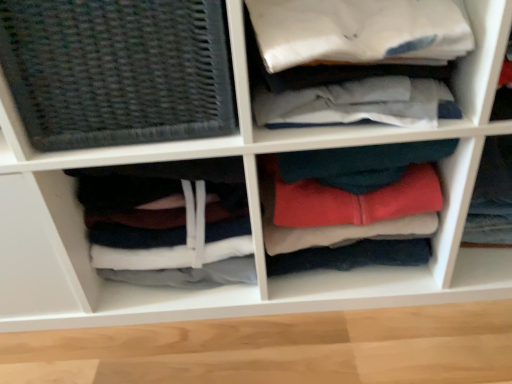
The width and height of the screenshot is (512, 384). What do you see at coordinates (351, 207) in the screenshot? I see `soft fleece hoodie at center, the 2th clothing from the left` at bounding box center [351, 207].

The image size is (512, 384). What do you see at coordinates (492, 195) in the screenshot? I see `red fleece hoodie at center, marked as the 1th clothing in a right-to-left arrangement` at bounding box center [492, 195].

I want to click on soft fleece hoodie at center, which is the second clothing from right to left, so click(x=351, y=207).

From the image's perspective, is red fleece hoodie at center, marked as the 1th clothing in a right-to-left arrangement, positioned above or below soft fleece hoodie at center, the 2th clothing from the left?

A: From the image's perspective, red fleece hoodie at center, marked as the 1th clothing in a right-to-left arrangement, appears above soft fleece hoodie at center, the 2th clothing from the left.

Does red fleece hoodie at center, the third clothing in the left-to-right sequence, turn towards soft fleece hoodie at center, the 2th clothing from the left?

No, red fleece hoodie at center, the third clothing in the left-to-right sequence, is not aimed at soft fleece hoodie at center, the 2th clothing from the left.

From the picture: Is red fleece hoodie at center, the third clothing in the left-to-right sequence, far from soft fleece hoodie at center, which is the second clothing from right to left?

No, red fleece hoodie at center, the third clothing in the left-to-right sequence, is in close proximity to soft fleece hoodie at center, which is the second clothing from right to left.

Considering the relative sizes of red fleece hoodie at center, the third clothing in the left-to-right sequence, and soft fleece hoodie at center, the 2th clothing from the left, in the image provided, is red fleece hoodie at center, the third clothing in the left-to-right sequence, thinner than soft fleece hoodie at center, the 2th clothing from the left,?

In fact, red fleece hoodie at center, the third clothing in the left-to-right sequence, might be wider than soft fleece hoodie at center, the 2th clothing from the left.

How much distance is there between dark gray fabric at lower left, which ranks as the 1th clothing in left-to-right order, and red fleece hoodie at center, the third clothing in the left-to-right sequence?

The distance of dark gray fabric at lower left, which ranks as the 1th clothing in left-to-right order, from red fleece hoodie at center, the third clothing in the left-to-right sequence, is 23.16 inches.

Between dark gray fabric at lower left, which ranks as the 1th clothing in left-to-right order, and red fleece hoodie at center, the third clothing in the left-to-right sequence, which one has less height?

Standing shorter between the two is red fleece hoodie at center, the third clothing in the left-to-right sequence.

Considering the sizes of objects dark gray fabric at lower left, the 3th clothing viewed from the right, and red fleece hoodie at center, the third clothing in the left-to-right sequence, in the image provided, who is bigger, dark gray fabric at lower left, the 3th clothing viewed from the right, or red fleece hoodie at center, the third clothing in the left-to-right sequence,?

dark gray fabric at lower left, the 3th clothing viewed from the right, is bigger.

From a real-world perspective, which is physically below, dark gray woven mat at left or soft fleece hoodie at center, which is the second clothing from right to left?

soft fleece hoodie at center, which is the second clothing from right to left, is physically lower.

Would you consider dark gray woven mat at left to be distant from soft fleece hoodie at center, the 2th clothing from the left?

dark gray woven mat at left is near soft fleece hoodie at center, the 2th clothing from the left, not far away.

Is soft fleece hoodie at center, which is the second clothing from right to left, a part of dark gray woven mat at left?

That's incorrect, soft fleece hoodie at center, which is the second clothing from right to left, is not inside dark gray woven mat at left.

Where is `basket that appears above the soft fleece hoodie at center, which is the second clothing from right to left (from the image's perspective)`? basket that appears above the soft fleece hoodie at center, which is the second clothing from right to left (from the image's perspective) is located at coordinates coord(117,71).

Who is smaller, dark gray woven mat at left or red fleece hoodie at center, marked as the 1th clothing in a right-to-left arrangement?

red fleece hoodie at center, marked as the 1th clothing in a right-to-left arrangement, is smaller.

Considering the positions of objects dark gray woven mat at left and red fleece hoodie at center, marked as the 1th clothing in a right-to-left arrangement, in the image provided, who is more to the left, dark gray woven mat at left or red fleece hoodie at center, marked as the 1th clothing in a right-to-left arrangement,?

dark gray woven mat at left.

Locate an element on the screen. The image size is (512, 384). basket on the left side of red fleece hoodie at center, the third clothing in the left-to-right sequence is located at coordinates (117, 71).

Does dark gray woven mat at left turn towards red fleece hoodie at center, marked as the 1th clothing in a right-to-left arrangement?

No, dark gray woven mat at left is not facing towards red fleece hoodie at center, marked as the 1th clothing in a right-to-left arrangement.

Is soft fleece hoodie at center, the 2th clothing from the left, taller than red fleece hoodie at center, marked as the 1th clothing in a right-to-left arrangement?

Indeed, soft fleece hoodie at center, the 2th clothing from the left, has a greater height compared to red fleece hoodie at center, marked as the 1th clothing in a right-to-left arrangement.

Between soft fleece hoodie at center, the 2th clothing from the left, and red fleece hoodie at center, the third clothing in the left-to-right sequence, which one appears on the right side from the viewer's perspective?

From the viewer's perspective, red fleece hoodie at center, the third clothing in the left-to-right sequence, appears more on the right side.

From a real-world perspective, between soft fleece hoodie at center, which is the second clothing from right to left, and red fleece hoodie at center, marked as the 1th clothing in a right-to-left arrangement, who is vertically lower?

From a 3D spatial view, red fleece hoodie at center, marked as the 1th clothing in a right-to-left arrangement, is below.

Identify the location of the 2nd clothing behind when counting from the soft fleece hoodie at center, which is the second clothing from right to left. click(492, 195).

Is soft fleece hoodie at center, the 2th clothing from the left, outside of dark gray fabric at lower left, which ranks as the 1th clothing in left-to-right order?

Yes, soft fleece hoodie at center, the 2th clothing from the left, is located beyond the bounds of dark gray fabric at lower left, which ranks as the 1th clothing in left-to-right order.

Is soft fleece hoodie at center, which is the second clothing from right to left, turned away from dark gray fabric at lower left, the 3th clothing viewed from the right?

No, soft fleece hoodie at center, which is the second clothing from right to left, is not facing away from dark gray fabric at lower left, the 3th clothing viewed from the right.

Which of these two, soft fleece hoodie at center, which is the second clothing from right to left, or dark gray fabric at lower left, which ranks as the 1th clothing in left-to-right order, is smaller?

soft fleece hoodie at center, which is the second clothing from right to left.

From a real-world perspective, is soft fleece hoodie at center, the 2th clothing from the left, located higher than dark gray fabric at lower left, the 3th clothing viewed from the right?

Yes, from a real-world perspective, soft fleece hoodie at center, the 2th clothing from the left, is on top of dark gray fabric at lower left, the 3th clothing viewed from the right.

Is dark gray fabric at lower left, the 3th clothing viewed from the right, turned away from dark gray woven mat at left?

That's not correct — dark gray fabric at lower left, the 3th clothing viewed from the right, is not looking away from dark gray woven mat at left.

Would you say dark gray fabric at lower left, the 3th clothing viewed from the right, contains dark gray woven mat at left?

No, dark gray fabric at lower left, the 3th clothing viewed from the right, does not contain dark gray woven mat at left.

Is dark gray fabric at lower left, which ranks as the 1th clothing in left-to-right order, taller or shorter than dark gray woven mat at left?

Clearly, dark gray fabric at lower left, which ranks as the 1th clothing in left-to-right order, is taller compared to dark gray woven mat at left.

Relative to dark gray woven mat at left, is dark gray fabric at lower left, which ranks as the 1th clothing in left-to-right order, in front or behind?

Clearly, dark gray fabric at lower left, which ranks as the 1th clothing in left-to-right order, is behind dark gray woven mat at left.

Starting from the red fleece hoodie at center, marked as the 1th clothing in a right-to-left arrangement, which clothing is the 1st one to the left? Please provide its 2D coordinates.

[(351, 207)]

There is a dark gray fabric at lower left, which ranks as the 1th clothing in left-to-right order. In order to click on the 2nd clothing above it (from the image's perspective) in this screenshot , I will do (492, 195).

Based on their spatial positions, is dark gray woven mat at left or soft fleece hoodie at center, which is the second clothing from right to left, closer to red fleece hoodie at center, the third clothing in the left-to-right sequence?

soft fleece hoodie at center, which is the second clothing from right to left.

When comparing their distances from soft fleece hoodie at center, the 2th clothing from the left, does dark gray fabric at lower left, which ranks as the 1th clothing in left-to-right order, or red fleece hoodie at center, marked as the 1th clothing in a right-to-left arrangement, seem further?

red fleece hoodie at center, marked as the 1th clothing in a right-to-left arrangement, is positioned further to the anchor soft fleece hoodie at center, the 2th clothing from the left.

Based on their spatial positions, is dark gray fabric at lower left, the 3th clothing viewed from the right, or soft fleece hoodie at center, which is the second clothing from right to left, closer to red fleece hoodie at center, marked as the 1th clothing in a right-to-left arrangement?

The object closer to red fleece hoodie at center, marked as the 1th clothing in a right-to-left arrangement, is soft fleece hoodie at center, which is the second clothing from right to left.

Which object lies further to the anchor point dark gray fabric at lower left, the 3th clothing viewed from the right, red fleece hoodie at center, marked as the 1th clothing in a right-to-left arrangement, or soft fleece hoodie at center, which is the second clothing from right to left?

Based on the image, red fleece hoodie at center, marked as the 1th clothing in a right-to-left arrangement, appears to be further to dark gray fabric at lower left, the 3th clothing viewed from the right.

From the image, which object appears to be farther from dark gray fabric at lower left, the 3th clothing viewed from the right, dark gray woven mat at left or red fleece hoodie at center, marked as the 1th clothing in a right-to-left arrangement?

red fleece hoodie at center, marked as the 1th clothing in a right-to-left arrangement, is further to dark gray fabric at lower left, the 3th clothing viewed from the right.

Which object lies further to the anchor point red fleece hoodie at center, marked as the 1th clothing in a right-to-left arrangement, dark gray woven mat at left or dark gray fabric at lower left, which ranks as the 1th clothing in left-to-right order?

dark gray woven mat at left is positioned further to the anchor red fleece hoodie at center, marked as the 1th clothing in a right-to-left arrangement.

Considering their positions, is red fleece hoodie at center, marked as the 1th clothing in a right-to-left arrangement, positioned further to dark gray fabric at lower left, the 3th clothing viewed from the right, than dark gray woven mat at left?

The object further to dark gray fabric at lower left, the 3th clothing viewed from the right, is red fleece hoodie at center, marked as the 1th clothing in a right-to-left arrangement.

From the image, which object appears to be nearer to dark gray fabric at lower left, which ranks as the 1th clothing in left-to-right order, dark gray woven mat at left or soft fleece hoodie at center, the 2th clothing from the left?

soft fleece hoodie at center, the 2th clothing from the left, lies closer to dark gray fabric at lower left, which ranks as the 1th clothing in left-to-right order, than the other object.

The height and width of the screenshot is (384, 512). Identify the location of clothing between dark gray woven mat at left and soft fleece hoodie at center, which is the second clothing from right to left, in the horizontal direction. (168, 222).

At what (x,y) coordinates should I click in order to perform the action: click on clothing between dark gray fabric at lower left, which ranks as the 1th clothing in left-to-right order, and red fleece hoodie at center, marked as the 1th clothing in a right-to-left arrangement, in the horizontal direction. Please return your answer as a coordinate pair (x, y). The height and width of the screenshot is (384, 512). Looking at the image, I should click on (351, 207).